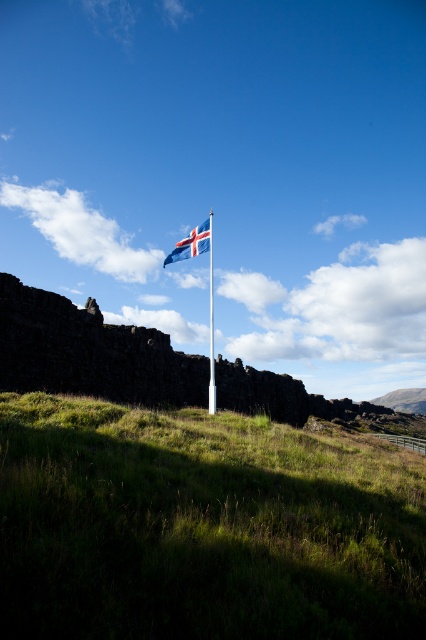
Looking at this image, you are standing on the green grassy hillside at center and want to reach the blue fabric flag at center. Which direction should you move to get closer to the flag?

The green grassy hillside at center is below the blue fabric flag at center, so you should move upward to get closer to the flag.

You are standing at the camera position looking at the scene. There is a point marked at coordinates point [176,257]. Can you walk directly towards this point from your current position without any obstacles?

The point [176,257] is 27.12 meters away from the camera, so yes, you can walk directly towards it since there are no obstacles mentioned in the scene description between you and the point.

You are a photographer planning to take a photo of the green grassy hillside at center and the blue fabric flag at center. Which object will occupy more space in the photo?

The blue fabric flag at center will occupy more space in the photo because the green grassy hillside at center has a smaller size compared to the blue fabric flag at center.